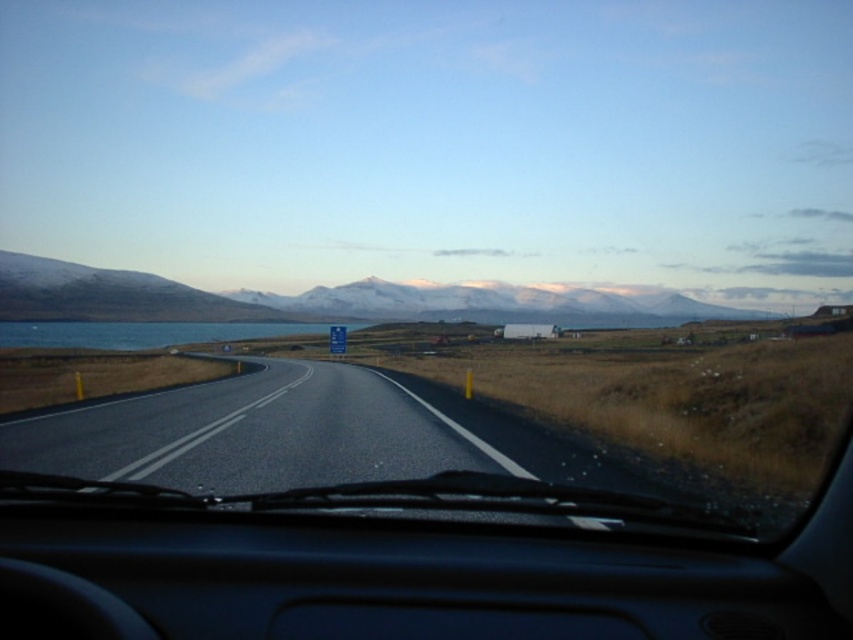
Is snowy mountain at center below blue water at left?

No, snowy mountain at center is not below blue water at left.

Which of these two, snowy mountain at center or blue water at left, stands taller?

With more height is snowy mountain at center.

What are the coordinates of `snowy mountain at center` in the screenshot? It's located at (326, 298).